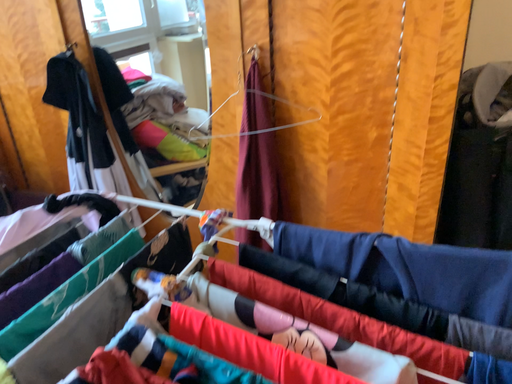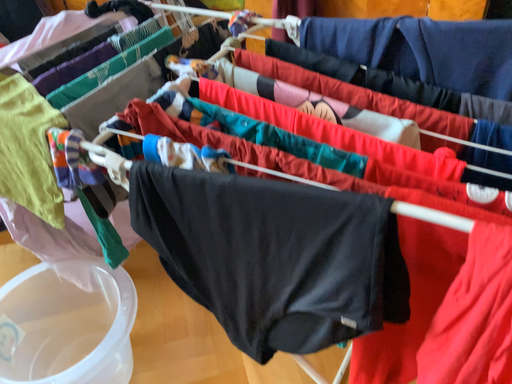
Question: Which way did the camera rotate in the video?

Choices:
 (A) rotated downward
 (B) rotated upward

Answer: (A)